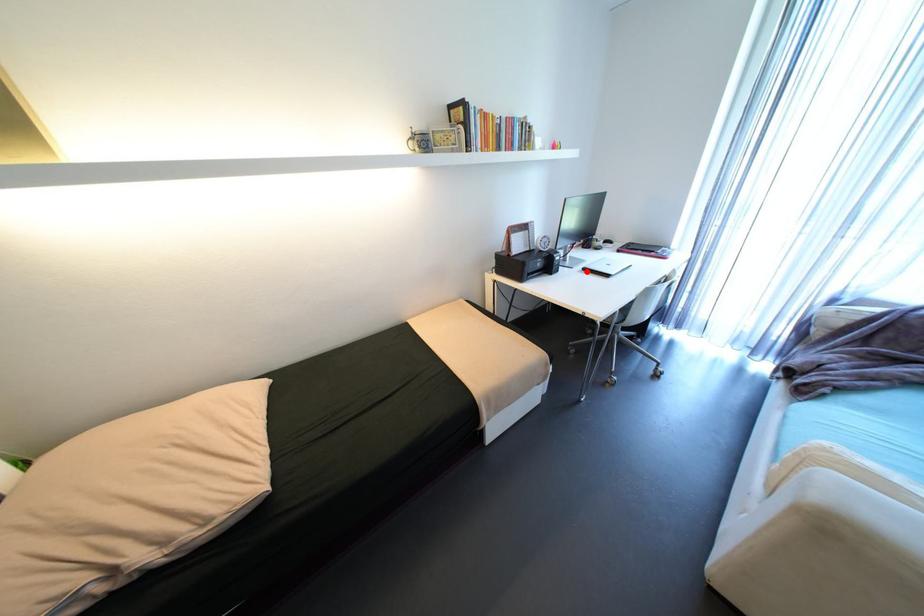
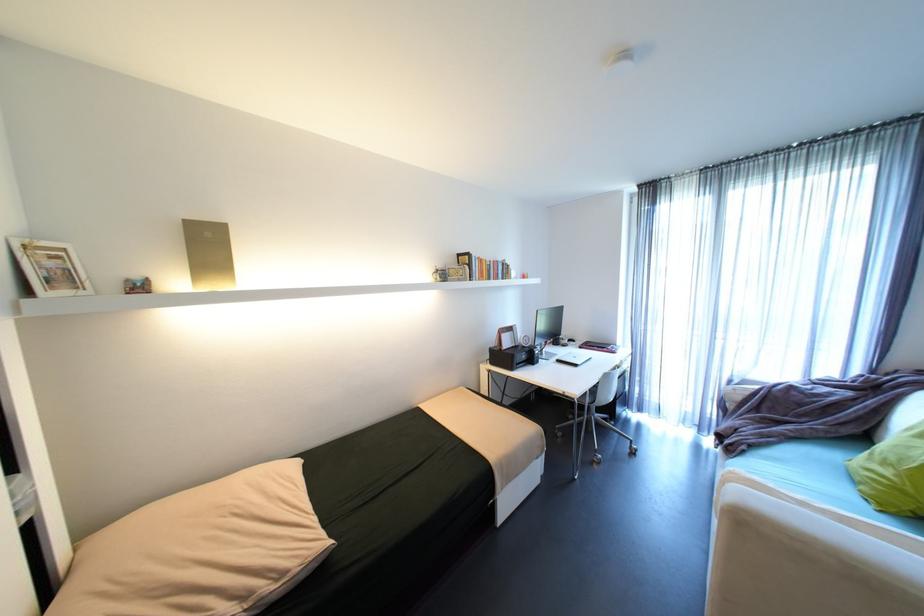
Locate, in the second image, the point that corresponds to the highlighted location in the first image.

(562, 363)